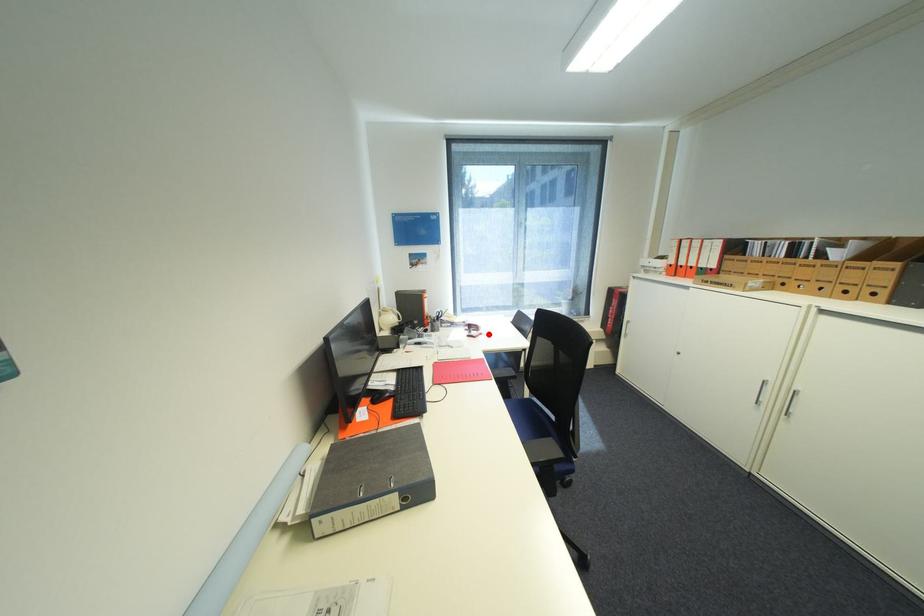
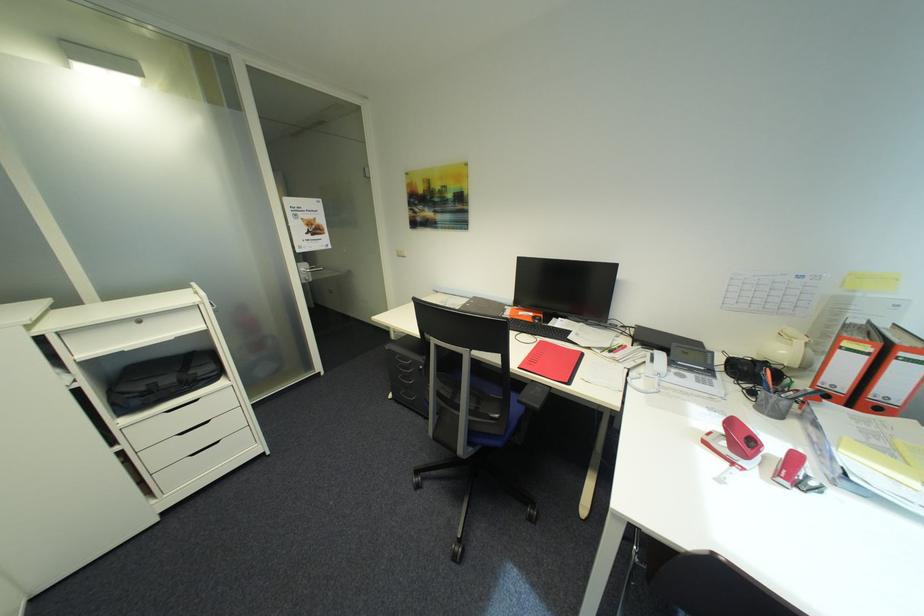
Where in the second image is the point corresponding to the highlighted location from the first image?

(742, 464)